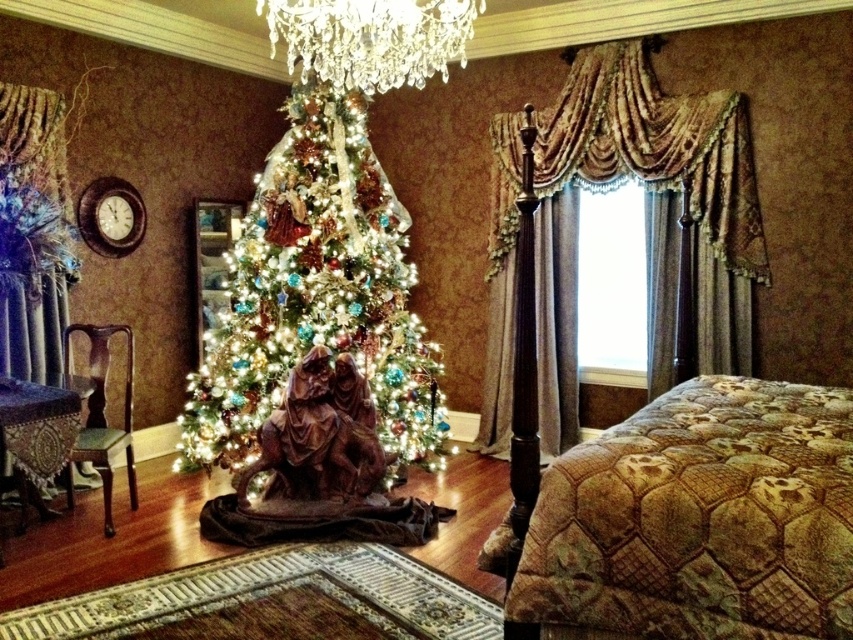
You are standing in the room and want to determine which of the two points, point [849,580] or point [335,42], is closer to you. Based on the scene description, which point is nearer?

Point [849,580] is closer to the viewer than point [335,42].

You are a guest in this holiday room and want to admire the crystal clear chandelier at upper center. From your position near the brown quilted bed at right, which direction should you look to see it?

The crystal clear chandelier at upper center is above the brown quilted bed at right, so you should look upward to see it.

You are standing in the center of the room facing the brown quilted bed at right and the crystal clear chandelier at upper center. Which object is located to the right of the other?

The brown quilted bed at right is to the right of the crystal clear chandelier at upper center, so the bed is positioned to the right side of the chandelier.